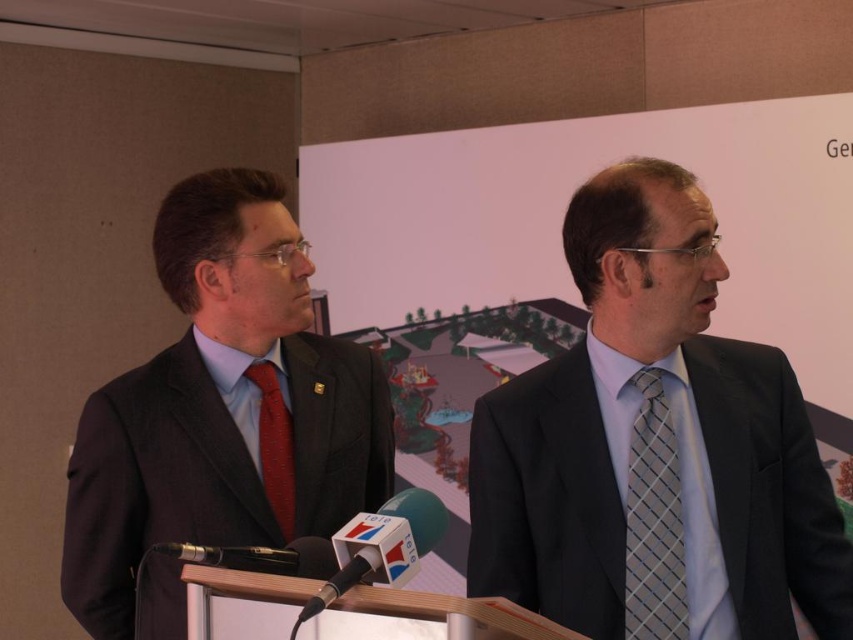
Question: Is light blue silk tie at right closer to camera compared to gray checkered tie at center?

Choices:
 (A) yes
 (B) no

Answer: (A)

Question: Which point appears farthest from the camera in this image?

Choices:
 (A) (517, 563)
 (B) (660, 540)
 (C) (140, 428)

Answer: (C)

Question: Where is matte black suit at left located in relation to gray checkered tie at center in the image?

Choices:
 (A) below
 (B) above

Answer: (B)

Question: Can you confirm if light blue silk tie at right is thinner than red silk tie at center?

Choices:
 (A) yes
 (B) no

Answer: (B)

Question: Which of these objects is positioned closest to the red silk tie at center?

Choices:
 (A) gray checkered tie at center
 (B) matte black suit at left

Answer: (B)

Question: Considering the real-world distances, which object is farthest from the matte black suit at left?

Choices:
 (A) red silk tie at center
 (B) light blue silk tie at right

Answer: (B)